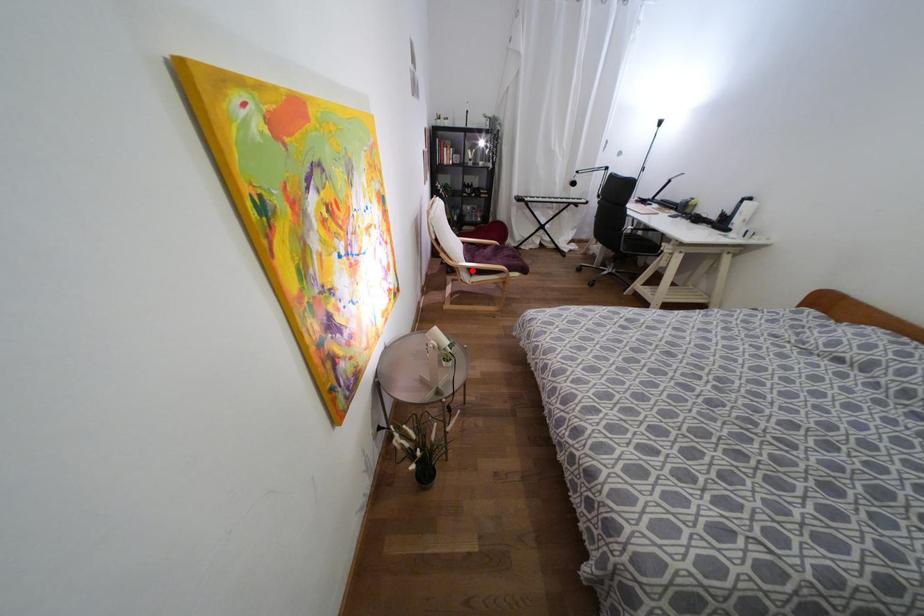
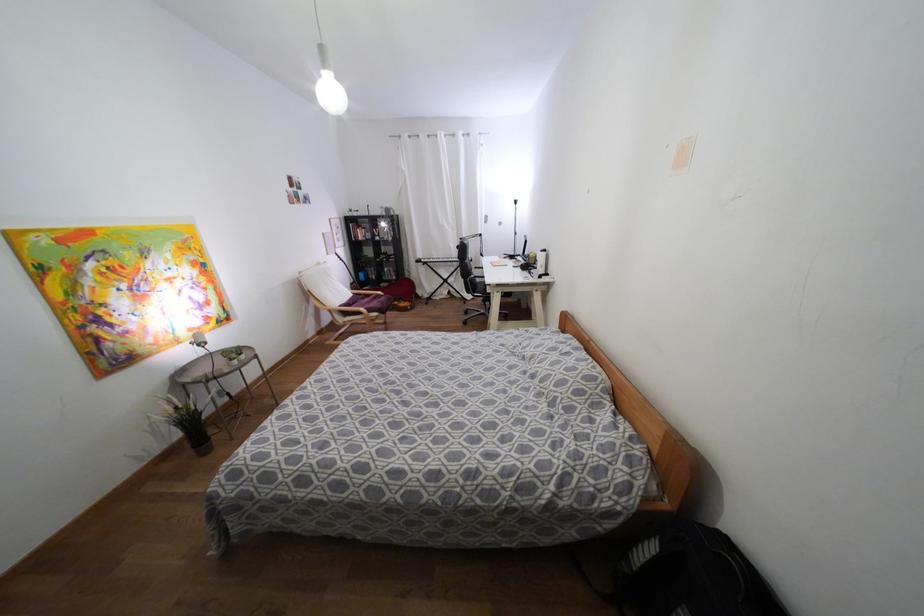
Question: I am providing you with two images of the same scene from different viewpoints. A red point is shown in image1. For the corresponding object point in image2, is it positioned nearer or farther from the camera?

Choices:
 (A) Nearer
 (B) Farther

Answer: (B)